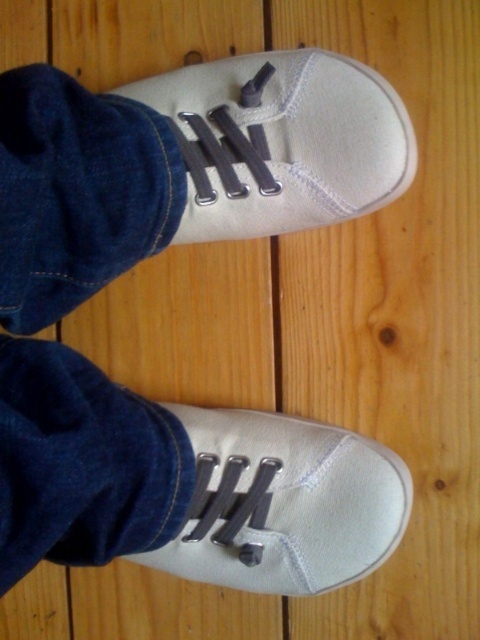
Question: Among these objects, which one is farthest from the camera?

Choices:
 (A) white canvas shoe at upper center
 (B) white canvas shoe at lower center

Answer: (B)

Question: Which point is closer to the camera?

Choices:
 (A) (254, 429)
 (B) (264, 230)

Answer: (B)

Question: Does white canvas shoe at upper center come in front of white canvas shoe at lower center?

Choices:
 (A) yes
 (B) no

Answer: (A)

Question: In this image, where is white canvas shoe at upper center located relative to white canvas shoe at lower center?

Choices:
 (A) left
 (B) right

Answer: (A)

Question: Which object is closer to the camera taking this photo?

Choices:
 (A) white canvas shoe at upper center
 (B) white canvas shoe at lower center

Answer: (A)

Question: Does white canvas shoe at upper center have a larger size compared to white canvas shoe at lower center?

Choices:
 (A) yes
 (B) no

Answer: (B)